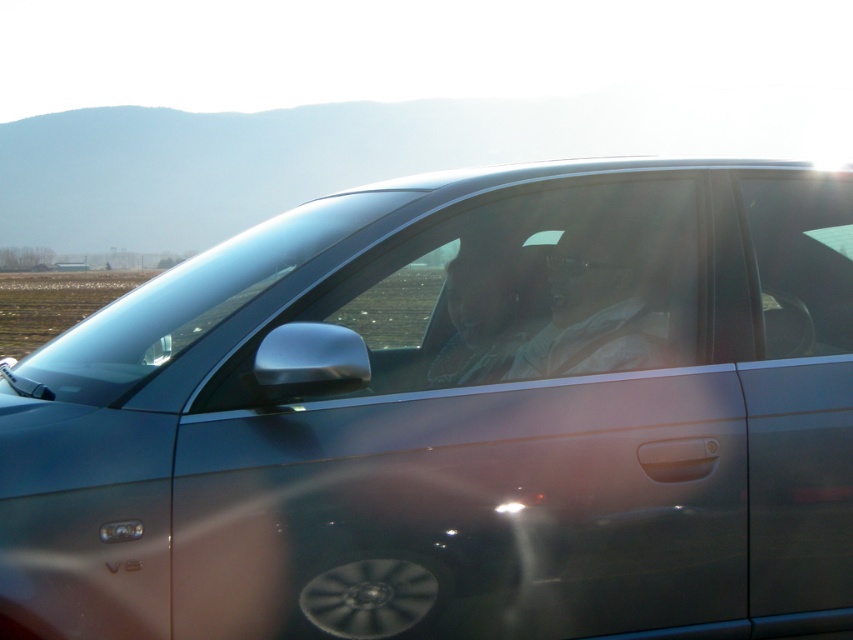
Question: Based on their relative distances, which object is farther from the matte gray shirt at center?

Choices:
 (A) transparent glass window at center
 (B) matte plastic face at center

Answer: (B)

Question: Which object appears closest to the camera in this image?

Choices:
 (A) matte plastic face at center
 (B) matte gray shirt at center
 (C) transparent glass window at center

Answer: (C)

Question: Can you confirm if transparent glass window at center is positioned to the left of matte gray shirt at center?

Choices:
 (A) yes
 (B) no

Answer: (A)

Question: Is transparent glass window at center positioned before matte plastic face at center?

Choices:
 (A) yes
 (B) no

Answer: (A)

Question: Is matte gray shirt at center smaller than matte plastic face at center?

Choices:
 (A) no
 (B) yes

Answer: (A)

Question: Which object is the farthest from the matte gray shirt at center?

Choices:
 (A) matte plastic face at center
 (B) transparent glass window at center

Answer: (A)